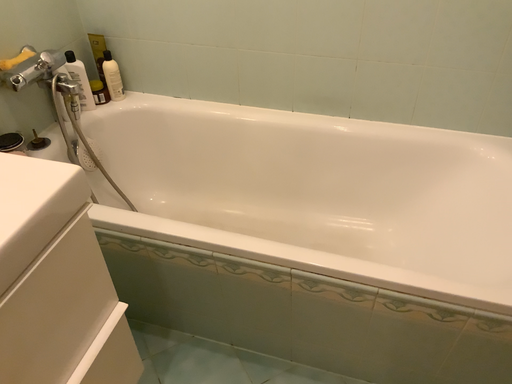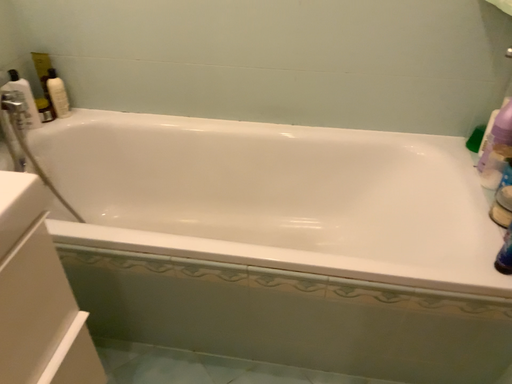
Question: Which way did the camera rotate in the video?

Choices:
 (A) rotated right
 (B) rotated left

Answer: (A)